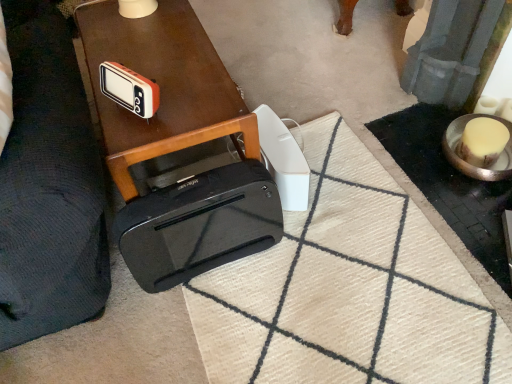
Identify the location of empty space that is to the right of orange plastic radio at upper left, arranged as the second gadget when viewed from the back. (195, 105).